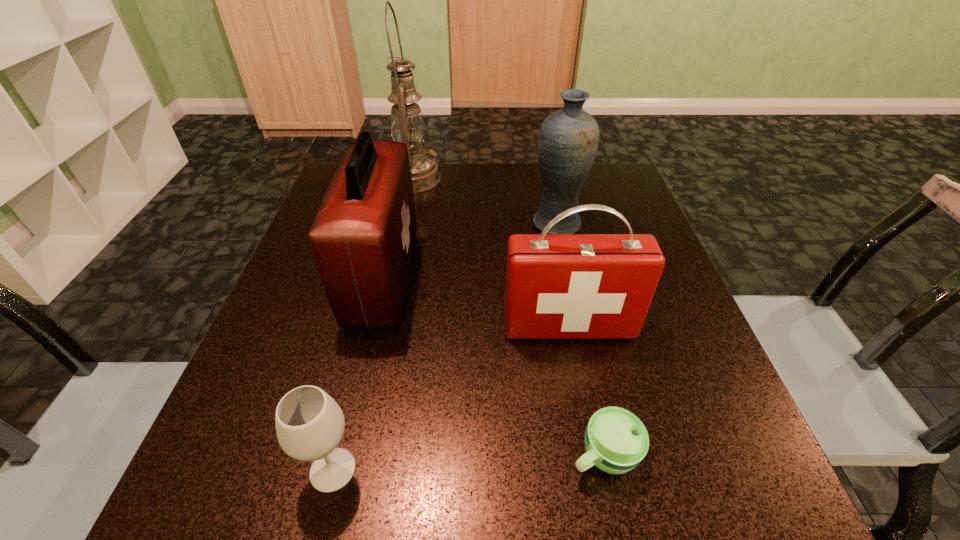
Identify the location of free location located 0.060m on the front face of the right first-aid kit. (578, 371).

The height and width of the screenshot is (540, 960). I want to click on vacant space located on the back of the fifth tallest object, so click(376, 291).

Locate an element on the screen. The image size is (960, 540). free space located on the back of the cup is located at coordinates (574, 316).

Find the location of a particular element. oil lamp situated at the far edge is located at coordinates (407, 126).

You are a GUI agent. You are given a task and a screenshot of the screen. Output one action in this format:
    pyautogui.click(x=<x>, y=<y>)
    Task: Click on the vase located in the far edge section of the desktop
    
    Given the screenshot: What is the action you would take?
    pyautogui.click(x=568, y=139)

Where is `wineglass that is at the near edge`? This screenshot has width=960, height=540. wineglass that is at the near edge is located at coordinates (309, 423).

At what (x,y) coordinates should I click in order to perform the action: click on cup present at the near edge. Please return your answer as a coordinate pair (x, y). The height and width of the screenshot is (540, 960). Looking at the image, I should click on (616, 441).

Where is `oil lamp that is at the left edge`? oil lamp that is at the left edge is located at coordinates (407, 126).

You are a GUI agent. You are given a task and a screenshot of the screen. Output one action in this format:
    pyautogui.click(x=<x>, y=<y>)
    Task: Click on the first aid kit that is at the left edge
    
    Given the screenshot: What is the action you would take?
    pyautogui.click(x=363, y=236)

You are a GUI agent. You are given a task and a screenshot of the screen. Output one action in this format:
    pyautogui.click(x=<x>, y=<y>)
    Task: Click on the wineglass that is at the left edge
    Image resolution: width=960 pixels, height=540 pixels.
    Given the screenshot: What is the action you would take?
    pyautogui.click(x=309, y=423)